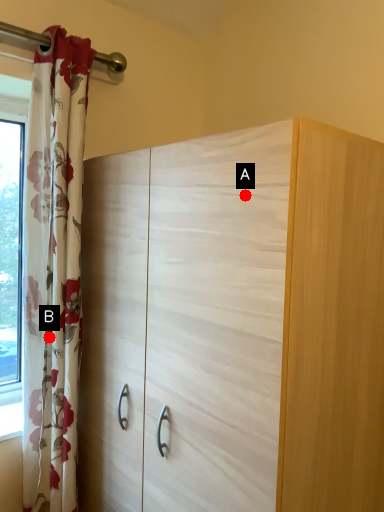
Question: Two points are circled on the image, labeled by A and B beside each circle. Which point appears closest to the camera in this image?

Choices:
 (A) A is closer
 (B) B is closer

Answer: (A)